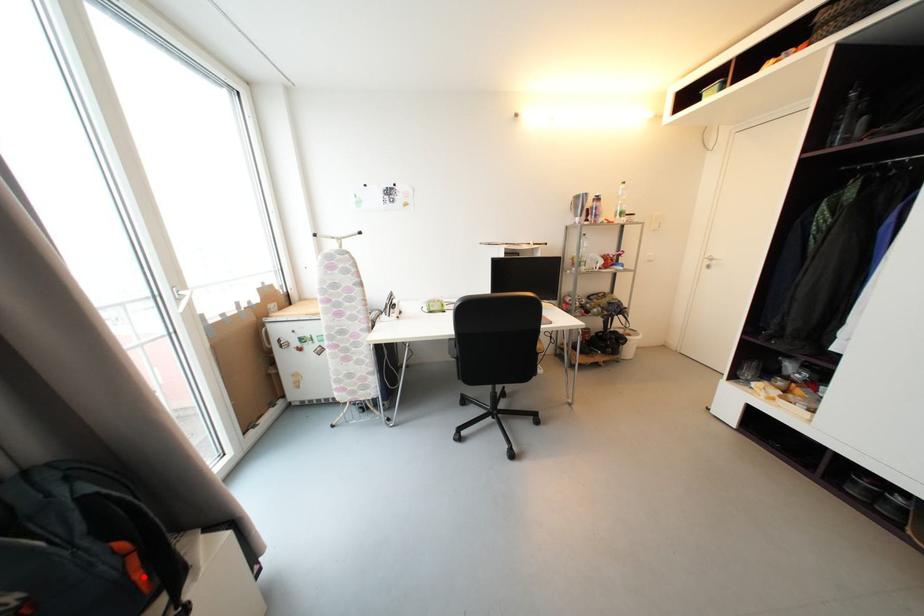
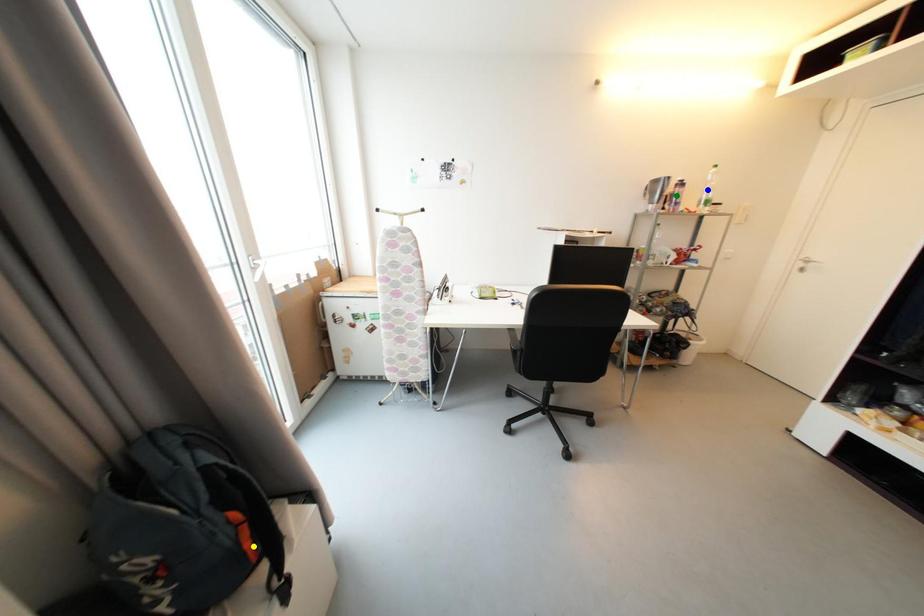
Question: I am providing you with two images of the same scene from different viewpoints. A red point is marked on the first image. You are given multiple points on the second image. Which point in image 2 is actually the same real-world point as the red point in image 1?

Choices:
 (A) green point
 (B) yellow point
 (C) blue point

Answer: (B)